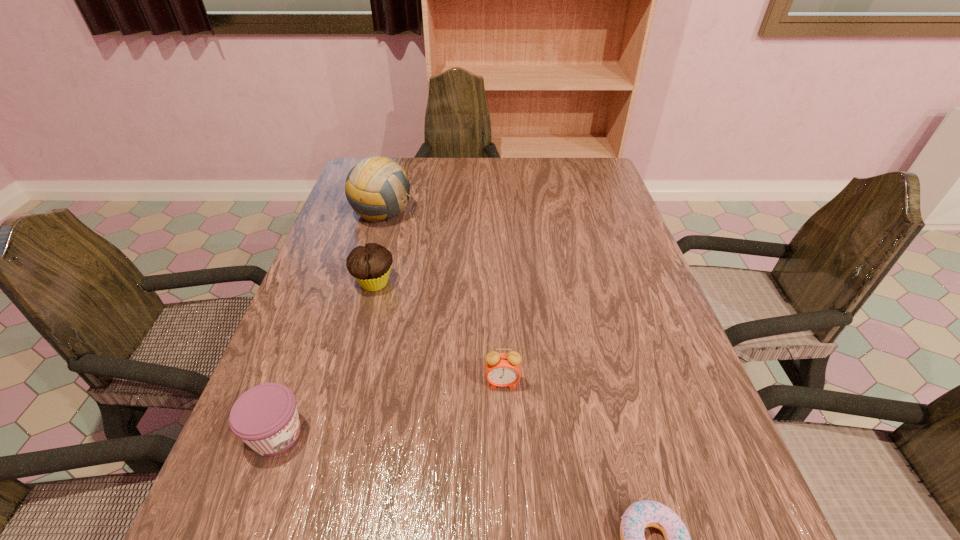
Find the location of a particular element. The height and width of the screenshot is (540, 960). the farthest object is located at coordinates (377, 188).

Find the location of a particular element. the tallest object is located at coordinates (377, 188).

At what (x,y) coordinates should I click in order to perform the action: click on the fourth object from left to right. Please return your answer as a coordinate pair (x, y). Image resolution: width=960 pixels, height=540 pixels. Looking at the image, I should click on (501, 369).

Locate an element on the screen. The width and height of the screenshot is (960, 540). the third nearest object is located at coordinates (501, 369).

You are a GUI agent. You are given a task and a screenshot of the screen. Output one action in this format:
    pyautogui.click(x=<x>, y=<y>)
    Task: Click on the second farthest object
    
    Given the screenshot: What is the action you would take?
    370,265

Image resolution: width=960 pixels, height=540 pixels. I want to click on jam, so click(x=265, y=417).

I want to click on the second shortest object, so click(265, 417).

Identify the location of free point located 0.100m on the right of the tallest object. (447, 212).

Where is `vacant space located 0.130m on the face of the third nearest object`? This screenshot has height=540, width=960. vacant space located 0.130m on the face of the third nearest object is located at coordinates (505, 454).

Image resolution: width=960 pixels, height=540 pixels. Find the location of `free space located 0.350m on the front of the second farthest object`. free space located 0.350m on the front of the second farthest object is located at coordinates (334, 436).